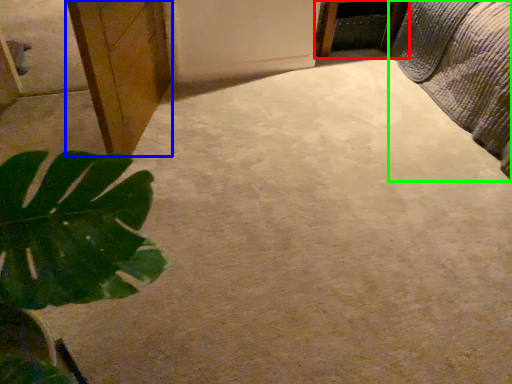
Question: Which is nearer to the furniture (highlighted by a red box)? cabinetry (highlighted by a blue box) or bed (highlighted by a green box).

Choices:
 (A) cabinetry
 (B) bed

Answer: (B)